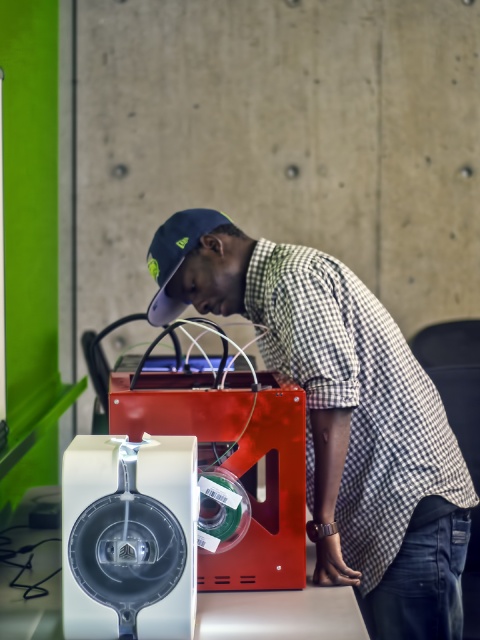
Question: Which point is farther to the camera?

Choices:
 (A) navy blue fabric baseball cap at center
 (B) checkered fabric shirt at center

Answer: (A)

Question: Where is checkered fabric shirt at center located in relation to navy blue fabric baseball cap at center in the image?

Choices:
 (A) left
 (B) right

Answer: (B)

Question: Can you confirm if checkered fabric shirt at center is positioned to the left of navy blue fabric baseball cap at center?

Choices:
 (A) no
 (B) yes

Answer: (A)

Question: Among these points, which one is farthest from the camera?

Choices:
 (A) (345, 545)
 (B) (205, 225)

Answer: (B)

Question: Which of the following is the closest to the observer?

Choices:
 (A) (389, 627)
 (B) (168, 282)

Answer: (A)

Question: Is checkered fabric shirt at center bigger than navy blue fabric baseball cap at center?

Choices:
 (A) no
 (B) yes

Answer: (B)